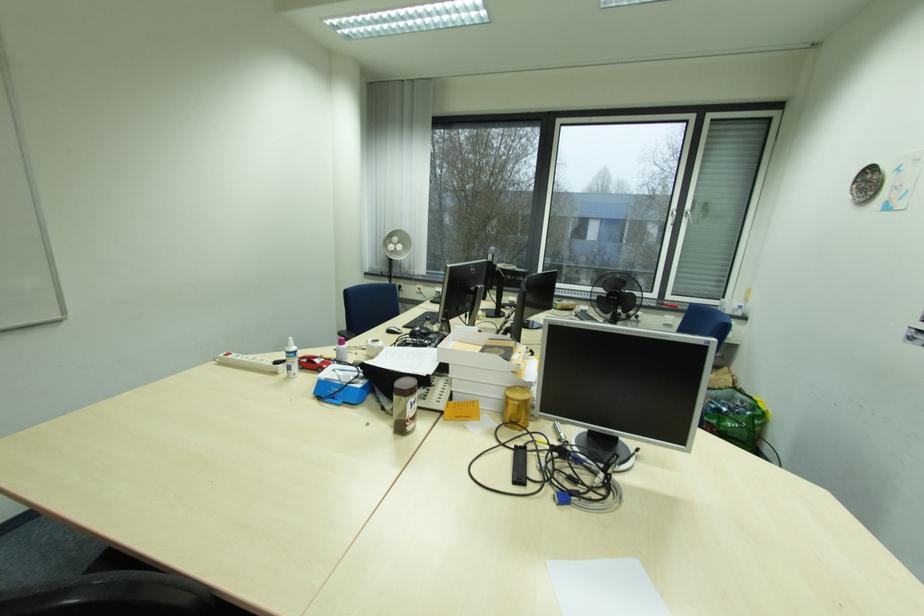
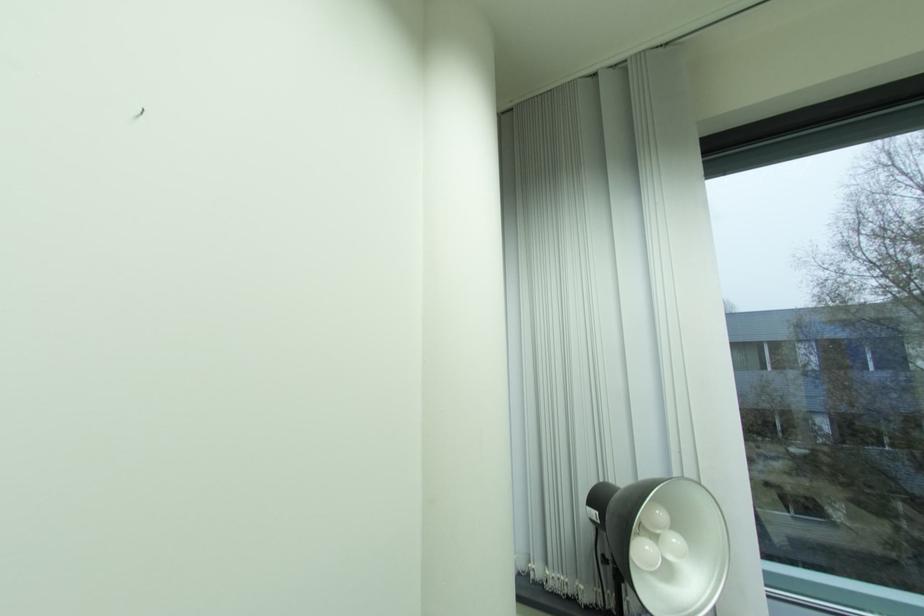
What movement of the cameraman would produce the second image?

The cameraman walked toward left, forward.